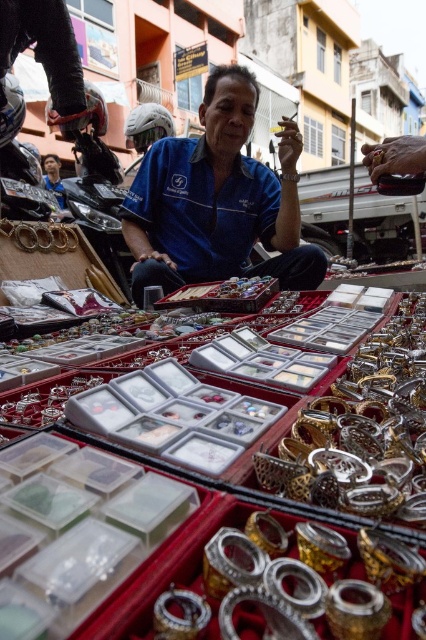
Which is below, gold metallic rings at center or gold metallic bracelet at center?

gold metallic rings at center is below.

Between gold metallic rings at center and gold metallic bracelet at center, which one appears on the right side from the viewer's perspective?

Positioned to the right is gold metallic rings at center.

The image size is (426, 640). What are the coordinates of `gold metallic rings at center` in the screenshot? It's located at (362, 428).

Which is behind, point (396, 451) or point (34, 225)?

The point (34, 225) is more distant.

Which of these two, gold metallic rings at center or gold metallic bangles at center, stands shorter?

With less height is gold metallic bangles at center.

You are a GUI agent. You are given a task and a screenshot of the screen. Output one action in this format:
    pyautogui.click(x=<x>, y=<y>)
    Task: Click on the gold metallic rings at center
    The width and height of the screenshot is (426, 640).
    Given the screenshot: What is the action you would take?
    pyautogui.click(x=362, y=428)

I want to click on gold metallic rings at center, so click(x=362, y=428).

Does blue fabric shirt at center have a larger size compared to gold metallic bracelet at center?

Yes.

Can you confirm if blue fabric shirt at center is shorter than gold metallic bracelet at center?

Incorrect, blue fabric shirt at center's height does not fall short of gold metallic bracelet at center's.

Find the location of a particular element. This screenshot has width=426, height=640. blue fabric shirt at center is located at coordinates (215, 202).